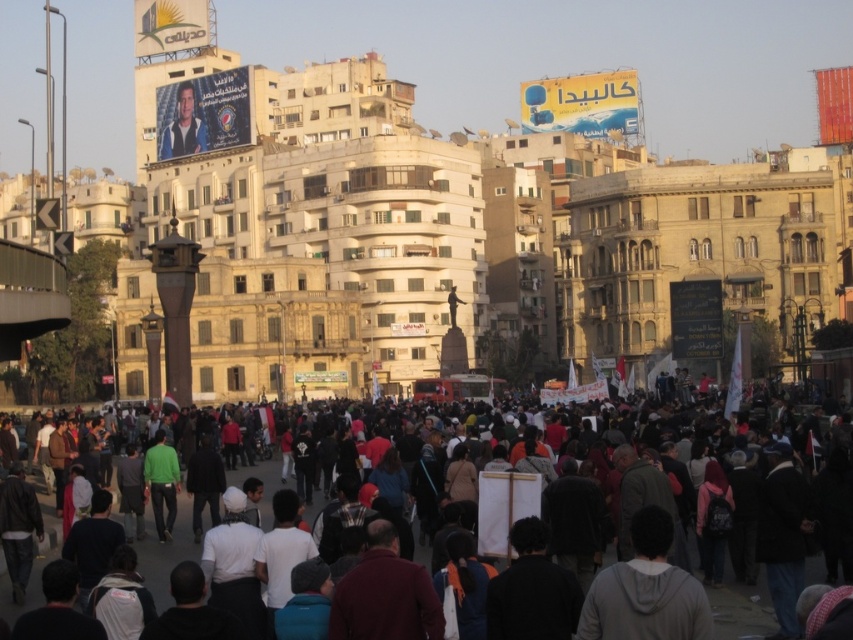
Question: Which is nearer to the dark gray clothing at center?

Choices:
 (A) silhouette figure at center
 (B) matte black poster at upper left

Answer: (A)

Question: Is matte black poster at upper left smaller than silhouette figure at center?

Choices:
 (A) yes
 (B) no

Answer: (B)

Question: Does dark gray clothing at center have a larger size compared to silhouette figure at center?

Choices:
 (A) no
 (B) yes

Answer: (B)

Question: Is the position of dark gray clothing at center more distant than that of matte black poster at upper left?

Choices:
 (A) no
 (B) yes

Answer: (A)

Question: Which object is the farthest from the silhouette figure at center?

Choices:
 (A) matte black poster at upper left
 (B) dark gray clothing at center

Answer: (B)

Question: Which of these objects is positioned farthest from the matte black poster at upper left?

Choices:
 (A) dark gray clothing at center
 (B) silhouette figure at center

Answer: (A)